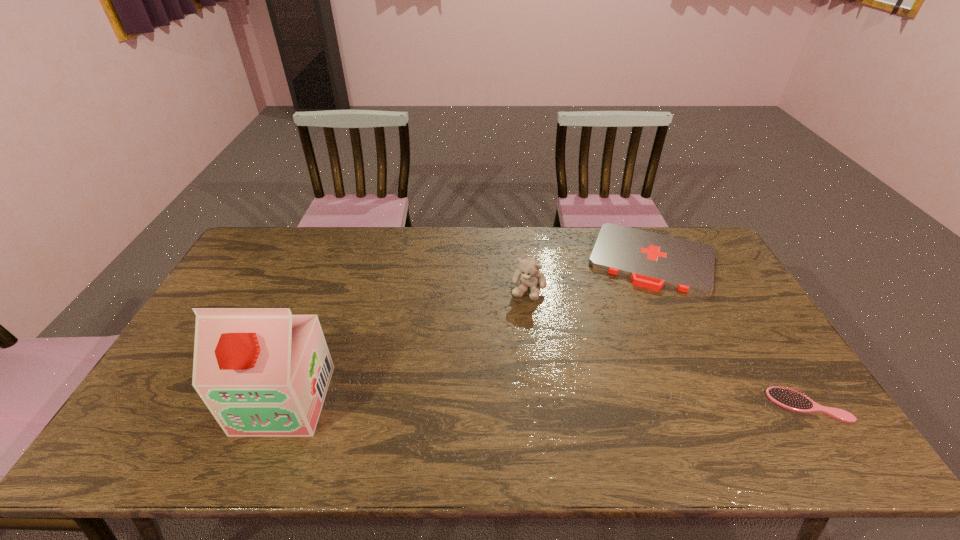
The height and width of the screenshot is (540, 960). I want to click on free space on the desktop that is between the soya milk and the hairbrush and is positioned on the face of the teddy bear, so click(x=483, y=402).

Find the location of a particular element. Image resolution: width=960 pixels, height=540 pixels. vacant space on the desktop that is between the tallest object and the hairbrush and is positioned on handle side the first-aid kit is located at coordinates (621, 403).